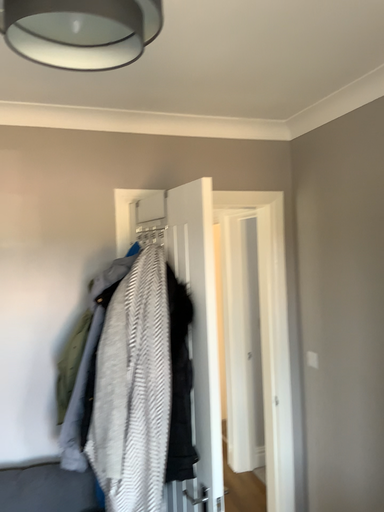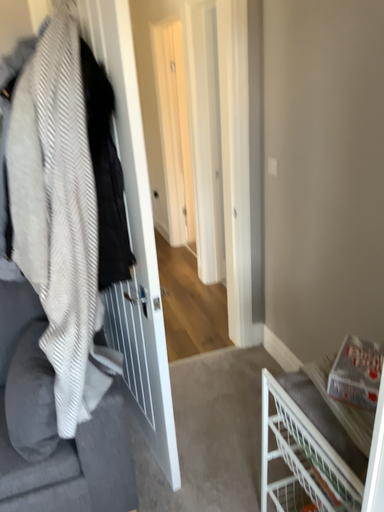
Question: How did the camera likely rotate when shooting the video?

Choices:
 (A) rotated upward
 (B) rotated downward

Answer: (B)